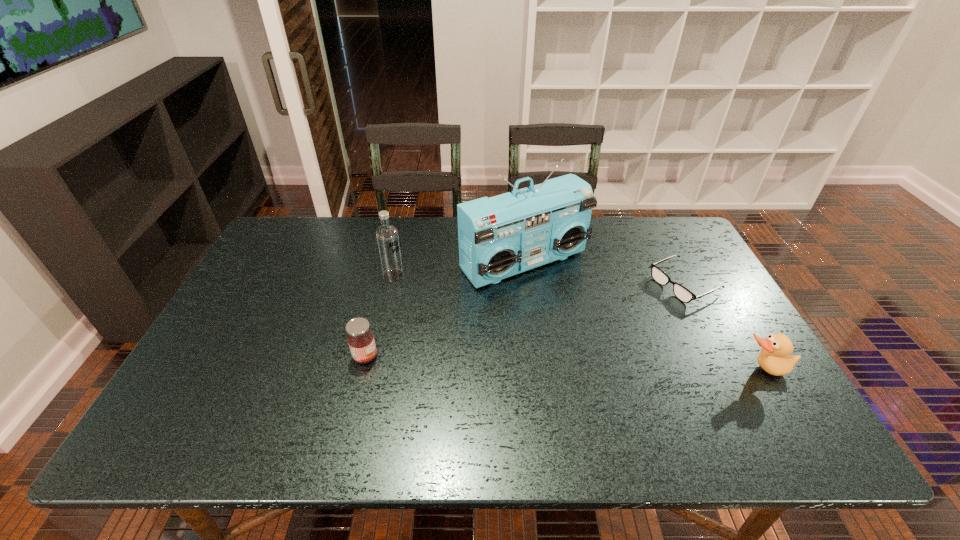
This screenshot has height=540, width=960. I want to click on vacant area between the third object from left to right and the spectacles, so (604, 273).

This screenshot has height=540, width=960. I want to click on unoccupied area between the duck and the shortest object, so click(x=724, y=327).

Find the location of a particular element. blank region between the third object from left to right and the vodka is located at coordinates (459, 269).

Where is `free spot between the duck and the third object from right to left`? This screenshot has width=960, height=540. free spot between the duck and the third object from right to left is located at coordinates (644, 316).

I want to click on vacant area between the fourth shortest object and the jam, so click(379, 316).

Find the location of a particular element. This screenshot has width=960, height=540. vacant space that is in between the tallest object and the duck is located at coordinates (644, 316).

Where is `vacant area between the second tallest object and the tallest object`? vacant area between the second tallest object and the tallest object is located at coordinates (459, 269).

This screenshot has height=540, width=960. Identify the location of free space between the third object from right to left and the duck. (644, 316).

Identify the location of object that is the closest to the jam. Image resolution: width=960 pixels, height=540 pixels. (387, 237).

Identify which object is located as the nearest to the radio receiver. Please provide its 2D coordinates. Your answer should be formatted as a tuple, i.e. [(x, y)], where the tuple contains the x and y coordinates of a point satisfying the conditions above.

[(387, 237)]